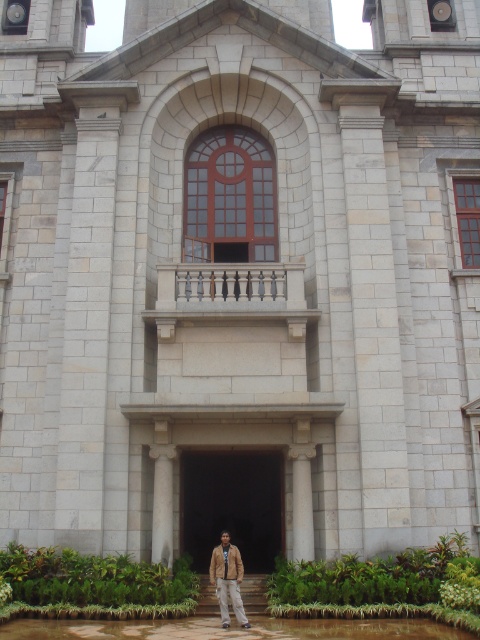
You are an architect planning to install a decorative light between the white marble column at center and the brown leather jacket at lower center. The light requires a minimum of 15 feet of space between the two objects to be safely installed. Based on the scene, can the light be installed?

The white marble column at center and brown leather jacket at lower center are 27.44 feet apart. Since the required minimum space is 15 feet, the light can be installed safely between them as there is sufficient distance.